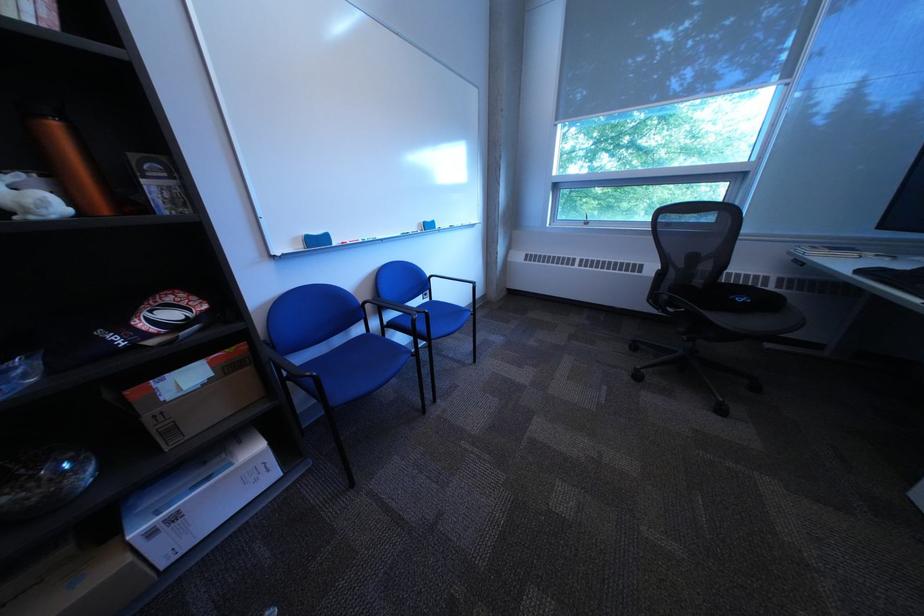
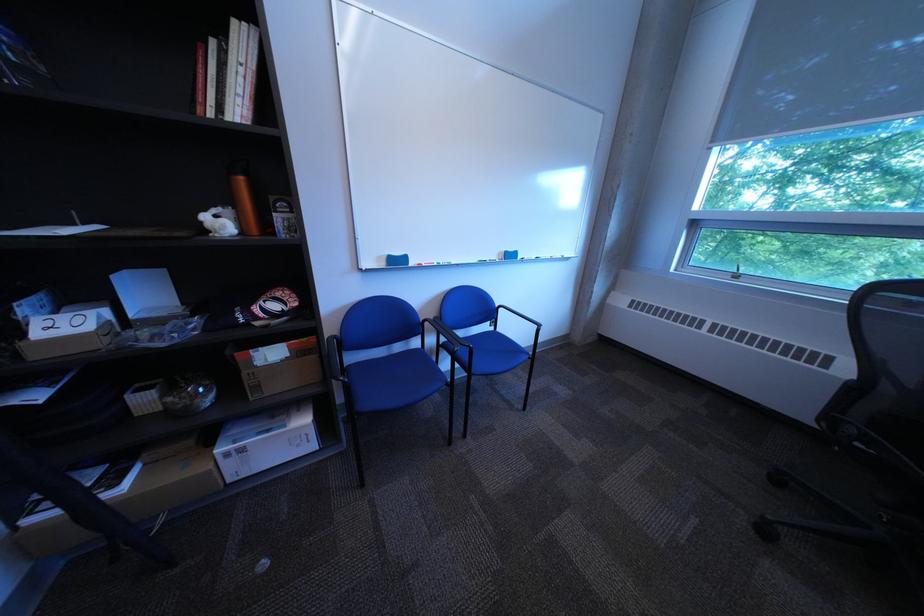
Question: The camera is either moving clockwise (left) or counter-clockwise (right) around the object. The first image is from the beginning of the video and the second image is from the end. Is the camera moving left or right when shooting the video?

Choices:
 (A) Left
 (B) Right

Answer: (B)